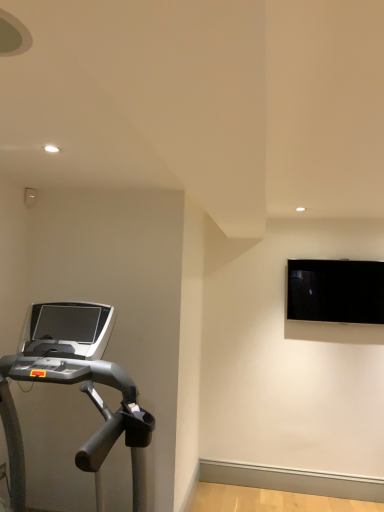
Question: Based on their sizes in the image, would you say silver metallic treadmill at left is bigger or smaller than black glossy monitor at upper right?

Choices:
 (A) big
 (B) small

Answer: (A)

Question: Based on their positions, is silver metallic treadmill at left located to the left or right of black glossy monitor at upper right?

Choices:
 (A) left
 (B) right

Answer: (A)

Question: Is silver metallic treadmill at left inside or outside of black glossy monitor at upper right?

Choices:
 (A) outside
 (B) inside

Answer: (A)

Question: Looking at their shapes, would you say black glossy monitor at upper right is wider or thinner than silver metallic treadmill at left?

Choices:
 (A) thin
 (B) wide

Answer: (A)

Question: From the image's perspective, relative to silver metallic treadmill at left, is black glossy monitor at upper right above or below?

Choices:
 (A) below
 (B) above

Answer: (B)

Question: Visually, is black glossy monitor at upper right positioned to the left or to the right of silver metallic treadmill at left?

Choices:
 (A) left
 (B) right

Answer: (B)

Question: Based on their sizes in the image, would you say black glossy monitor at upper right is bigger or smaller than silver metallic treadmill at left?

Choices:
 (A) small
 (B) big

Answer: (A)